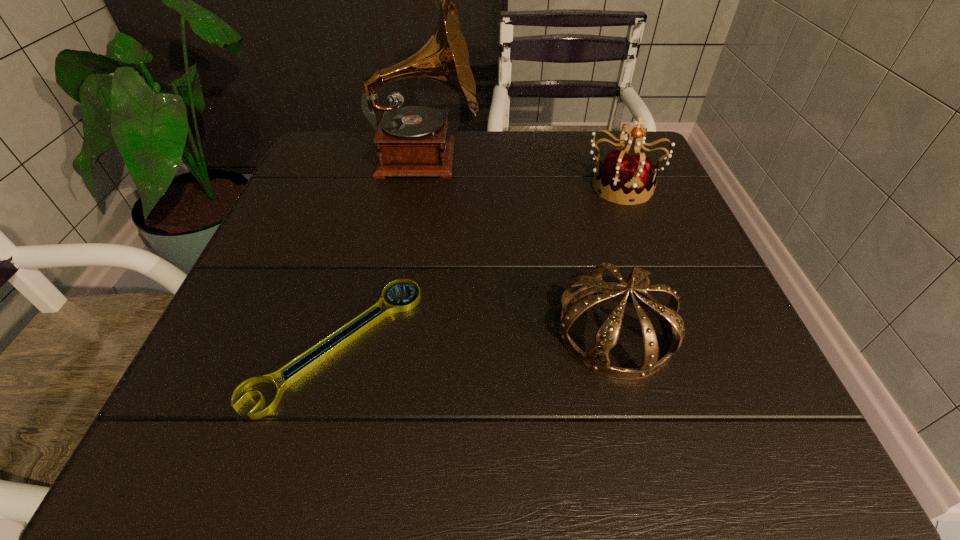
I want to click on phonograph_record located at the far edge, so click(x=414, y=142).

This screenshot has width=960, height=540. Identify the location of tiara located at the far edge. (626, 178).

Where is `object located at the near edge`? object located at the near edge is located at coordinates (296, 368).

I want to click on phonograph_record that is at the left edge, so click(414, 142).

Find the location of a particular element. The image size is (960, 540). wrench at the left edge is located at coordinates (296, 368).

Where is `object that is at the far left corner`? object that is at the far left corner is located at coordinates (414, 142).

The height and width of the screenshot is (540, 960). Find the location of `object positioned at the near left corner`. object positioned at the near left corner is located at coordinates pos(296,368).

Where is `object located in the far right corner section of the desktop`? Image resolution: width=960 pixels, height=540 pixels. object located in the far right corner section of the desktop is located at coordinates (626, 178).

Locate an element on the screen. The image size is (960, 540). vacant area at the far edge of the desktop is located at coordinates (525, 171).

Image resolution: width=960 pixels, height=540 pixels. Identify the location of vacant space at the near edge of the desktop. (482, 426).